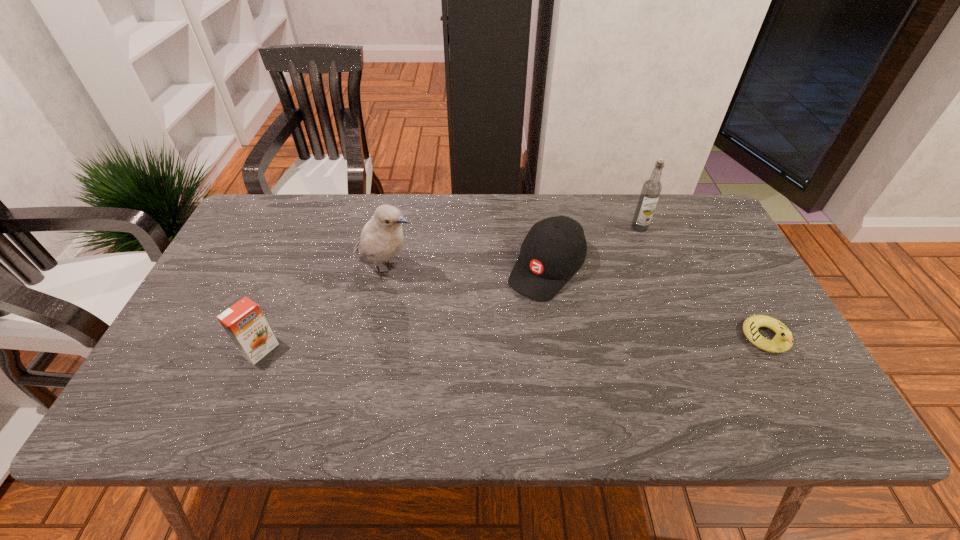
The image size is (960, 540). I want to click on vacant spot on the desktop that is between the leftmost object and the shortest object and is positioned on the label of the farthest object, so click(544, 343).

The image size is (960, 540). In order to click on vacant space on the desktop that is between the leftmost object and the shortest object and is positioned with a logo on the front of the baseball cap in this screenshot , I will do `click(483, 345)`.

Identify the location of free space on the desktop that is between the leftmost object and the rightmost object and is positioned at the beak of the fourth object from right to left. Image resolution: width=960 pixels, height=540 pixels. (549, 343).